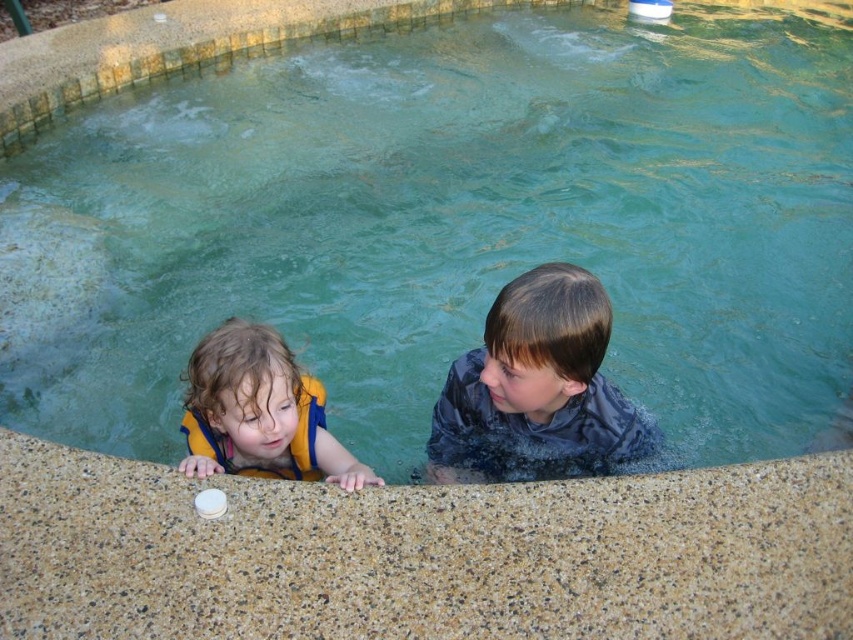
Question: Which point is closer to the camera taking this photo?

Choices:
 (A) (306, 465)
 (B) (535, 301)

Answer: (B)

Question: Does dark blue wet shirt at upper center appear over yellow life jacket at left?

Choices:
 (A) no
 (B) yes

Answer: (B)

Question: Is dark blue wet shirt at upper center thinner than yellow life jacket at left?

Choices:
 (A) yes
 (B) no

Answer: (B)

Question: Considering the real-world distances, which object is farthest from the yellow life jacket at left?

Choices:
 (A) yellow life vest at left
 (B) dark blue wet shirt at upper center

Answer: (B)

Question: Among these objects, which one is farthest from the camera?

Choices:
 (A) yellow life vest at left
 (B) yellow life jacket at left
 (C) dark blue wet shirt at upper center

Answer: (B)

Question: Can you confirm if yellow life vest at left is bigger than yellow life jacket at left?

Choices:
 (A) yes
 (B) no

Answer: (A)